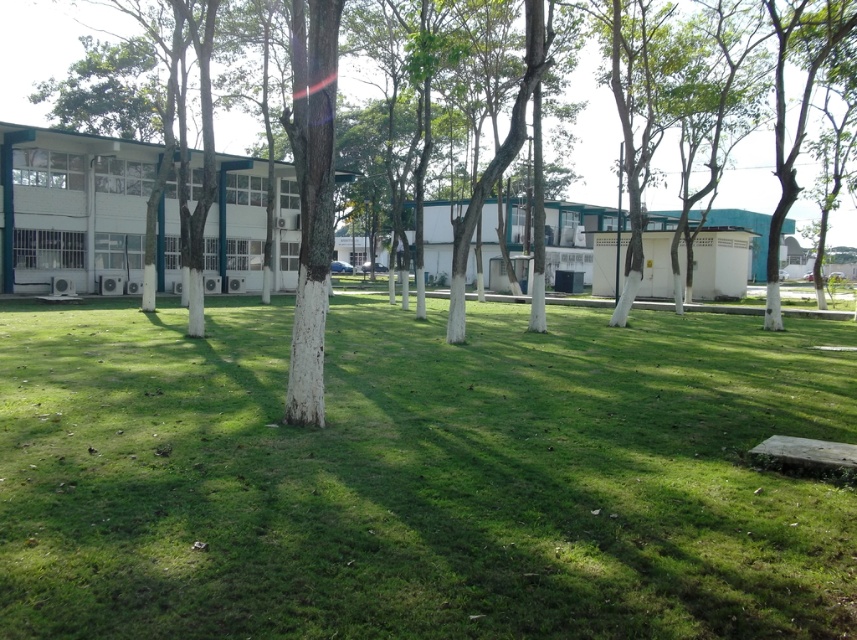
Between green grass at center and white textured tree at center, which one is positioned higher?

white textured tree at center is above.

From the picture: Does green grass at center lie behind white textured tree at center?

No, it is in front of white textured tree at center.

Does point (710, 604) come farther from viewer compared to point (576, 99)?

No, (710, 604) is in front of (576, 99).

At what (x,y) coordinates should I click in order to perform the action: click on green grass at center. Please return your answer as a coordinate pair (x, y). The height and width of the screenshot is (640, 857). Looking at the image, I should click on (x=418, y=476).